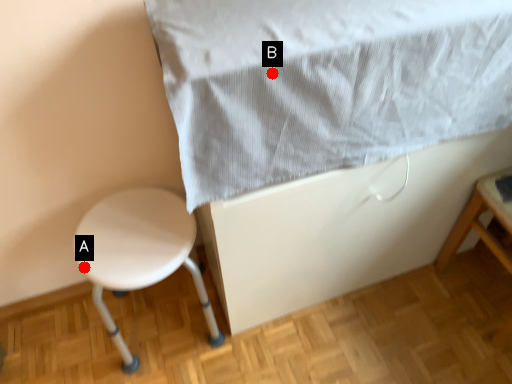
Question: Two points are circled on the image, labeled by A and B beside each circle. Among these points, which one is nearest to the camera?

Choices:
 (A) A is closer
 (B) B is closer

Answer: (B)